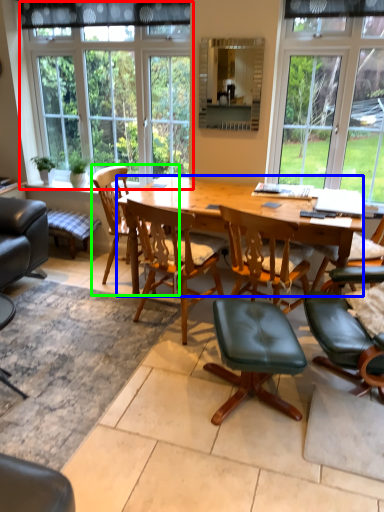
Question: Which is farther away from window (highlighted by a red box)? desk (highlighted by a blue box) or chair (highlighted by a green box)?

Choices:
 (A) desk
 (B) chair

Answer: (A)